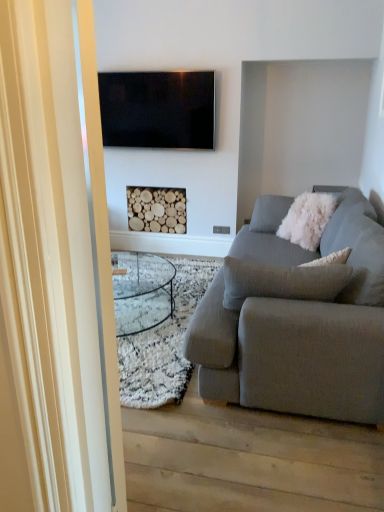
You are a GUI agent. You are given a task and a screenshot of the screen. Output one action in this format:
    pyautogui.click(x=<x>, y=<y>)
    Task: Click on the flat screen tv at upper center
    
    Given the screenshot: What is the action you would take?
    pyautogui.click(x=157, y=109)

Measure the distance between transparent glass door at left and camera.

transparent glass door at left and camera are 27.27 inches apart.

Find the location of a particular element. Image resolution: width=384 pixels, height=512 pixels. textured gray couch at right is located at coordinates (296, 322).

In order to face wooden logs at center, should I rotate leftwards or rightwards?

To align with it, rotate left about 4.561°.

You are a GUI agent. You are given a task and a screenshot of the screen. Output one action in this format:
    pyautogui.click(x=<x>, y=<y>)
    Task: Click on the flat screen tv at upper center
    This screenshot has width=384, height=512.
    Given the screenshot: What is the action you would take?
    tap(157, 109)

Where is `studio couch below the flat screen tv at upper center (from a real-world perspective)`? studio couch below the flat screen tv at upper center (from a real-world perspective) is located at coordinates [296, 322].

Which is nearer, (197,127) or (277,276)?

Point (197,127) appears to be farther away from the viewer than point (277,276).

What's the angular difference between flat screen tv at upper center and textured gray couch at right's facing directions?

The facing directions of flat screen tv at upper center and textured gray couch at right are 91.1 degrees apart.

From a real-world perspective, is flat screen tv at upper center on textured gray couch at right?

Indeed, from a real-world perspective, flat screen tv at upper center stands above textured gray couch at right.

The width and height of the screenshot is (384, 512). In the image, there is a textured gray couch at right. What are the coordinates of `pillow above it (from the image's perspective)` in the screenshot? It's located at (308, 219).

Is white fluffy pillow at right with textured gray couch at right?

No, white fluffy pillow at right is not with textured gray couch at right.

Which object is further away from the camera taking this photo, white fluffy pillow at right or textured gray couch at right?

white fluffy pillow at right.

From the image's perspective, relative to textured gray couch at right, is white fluffy pillow at right above or below?

white fluffy pillow at right is above textured gray couch at right.

From a real-world perspective, relative to flat screen tv at upper center, is white fluffy pillow at right vertically above or below?

Clearly, from a real-world perspective, white fluffy pillow at right is below flat screen tv at upper center.

From the image's perspective, is white fluffy pillow at right on top of flat screen tv at upper center?

No, from the image's perspective, white fluffy pillow at right is not over flat screen tv at upper center.

Which object is wider, white fluffy pillow at right or flat screen tv at upper center?

Wider between the two is white fluffy pillow at right.

How different are the orientations of white fluffy pillow at right and flat screen tv at upper center in degrees?

They differ by 51.3 degrees in their facing directions.

From a real-world perspective, between wooden logs at center and transparent glass door at left, who is vertically lower?

wooden logs at center, from a real-world perspective.

From the image's perspective, is wooden logs at center above or below transparent glass door at left?

wooden logs at center is above transparent glass door at left.

Find the location of a particular element. Image resolution: width=384 pixels, height=512 pixels. fireplace below the transparent glass door at left (from a real-world perspective) is located at coordinates (157, 209).

Are wooden logs at center and transparent glass door at left beside each other?

They are not placed beside each other.

Measure the distance from transparent glass door at left to textured gray couch at right.

1.29 meters.

Does transparent glass door at left appear on the left side of textured gray couch at right?

Indeed, transparent glass door at left is positioned on the left side of textured gray couch at right.

At what (x,y) coordinates should I click in order to perform the action: click on studio couch that appears above the transparent glass door at left (from the image's perspective). Please return your answer as a coordinate pair (x, y). Looking at the image, I should click on (296, 322).

Considering the sizes of objects transparent glass door at left and textured gray couch at right in the image provided, who is smaller, transparent glass door at left or textured gray couch at right?

transparent glass door at left is smaller.

Which object is wider, textured gray couch at right or flat screen tv at upper center?

textured gray couch at right is wider.

From the image's perspective, which one is positioned lower, textured gray couch at right or flat screen tv at upper center?

From the image's view, textured gray couch at right is below.

Which is more to the right, textured gray couch at right or flat screen tv at upper center?

Positioned to the right is textured gray couch at right.

In terms of width, does wooden logs at center look wider or thinner when compared to textured gray couch at right?

Considering their sizes, wooden logs at center looks slimmer than textured gray couch at right.

From the image's perspective, is wooden logs at center positioned above or below textured gray couch at right?

Clearly, from the image's perspective, wooden logs at center is above textured gray couch at right.

Does wooden logs at center have a lesser height compared to textured gray couch at right?

Indeed, wooden logs at center has a lesser height compared to textured gray couch at right.

I want to click on television behind the textured gray couch at right, so click(157, 109).

Identify the location of studio couch that is under the white fluffy pillow at right (from a real-world perspective). This screenshot has height=512, width=384. (296, 322).

From the image, which object appears to be nearer to flat screen tv at upper center, textured gray couch at right or white fluffy pillow at right?

Based on the image, white fluffy pillow at right appears to be nearer to flat screen tv at upper center.

Which object lies further to the anchor point wooden logs at center, textured gray couch at right or flat screen tv at upper center?

Among the two, textured gray couch at right is located further to wooden logs at center.

From the image, which object appears to be nearer to transparent glass door at left, wooden logs at center or flat screen tv at upper center?

Among the two, flat screen tv at upper center is located nearer to transparent glass door at left.

Looking at the image, which one is located further to textured gray couch at right, white fluffy pillow at right or wooden logs at center?

wooden logs at center lies further to textured gray couch at right than the other object.

Which object lies nearer to the anchor point wooden logs at center, white fluffy pillow at right or flat screen tv at upper center?

flat screen tv at upper center is positioned closer to the anchor wooden logs at center.

Looking at the image, which one is located closer to white fluffy pillow at right, transparent glass door at left or textured gray couch at right?

textured gray couch at right is closer to white fluffy pillow at right.

From the picture: Considering their positions, is textured gray couch at right positioned closer to transparent glass door at left than flat screen tv at upper center?

The object closer to transparent glass door at left is textured gray couch at right.

Looking at the image, which one is located closer to transparent glass door at left, white fluffy pillow at right or flat screen tv at upper center?

Among the two, white fluffy pillow at right is located nearer to transparent glass door at left.

The width and height of the screenshot is (384, 512). What are the coordinates of `television situated between wooden logs at center and white fluffy pillow at right from left to right` in the screenshot? It's located at (157, 109).

The image size is (384, 512). What are the coordinates of `pillow between textured gray couch at right and flat screen tv at upper center in the front-back direction` in the screenshot? It's located at (308, 219).

Where is `pillow between transparent glass door at left and flat screen tv at upper center from front to back`? This screenshot has width=384, height=512. pillow between transparent glass door at left and flat screen tv at upper center from front to back is located at coordinates 308,219.

Locate an element on the screen. This screenshot has height=512, width=384. television between textured gray couch at right and wooden logs at center from front to back is located at coordinates (157, 109).